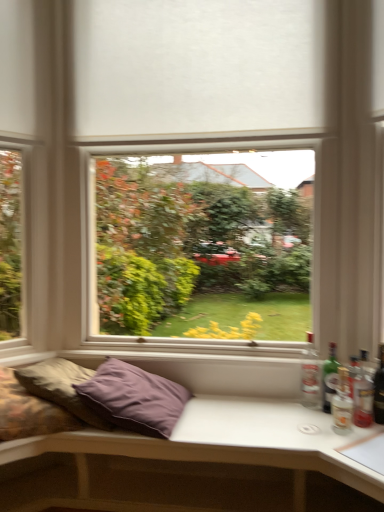
Locate an element on the screen. The height and width of the screenshot is (512, 384). white matte window at center is located at coordinates (192, 136).

This screenshot has width=384, height=512. Describe the element at coordinates (186, 463) in the screenshot. I see `purple fabric studio couch at lower center` at that location.

Image resolution: width=384 pixels, height=512 pixels. What are the coordinates of `white matte window at center` in the screenshot? It's located at (192, 136).

Is white matte window at center not within green glass bottle at right, the second bottle from the left?

white matte window at center lies outside green glass bottle at right, the second bottle from the left,'s area.

From the image's perspective, relative to green glass bottle at right, placed as the 2th bottle when sorted from front to back, is white matte window at center above or below?

From the image's perspective, white matte window at center appears above green glass bottle at right, placed as the 2th bottle when sorted from front to back.

Is white matte window at center directly adjacent to green glass bottle at right, the second bottle in the back-to-front sequence?

white matte window at center is not next to green glass bottle at right, the second bottle in the back-to-front sequence, and they're not touching.

How far apart are white matte window at center and green glass bottle at right, arranged as the 2th bottle when viewed from the right?

A distance of 1.12 meters exists between white matte window at center and green glass bottle at right, arranged as the 2th bottle when viewed from the right.

Based on the photo, in terms of height, does green glass bottle at right, placed as the 2th bottle when sorted from front to back, look taller or shorter compared to purple fabric pillow at lower left, the 2th pillow from the right?

Considering their sizes, green glass bottle at right, placed as the 2th bottle when sorted from front to back, has more height than purple fabric pillow at lower left, the 2th pillow from the right.

Considering the sizes of objects green glass bottle at right, the second bottle from the left, and purple fabric pillow at lower left, the 2th pillow from the right, in the image provided, who is bigger, green glass bottle at right, the second bottle from the left, or purple fabric pillow at lower left, the 2th pillow from the right,?

purple fabric pillow at lower left, the 2th pillow from the right, is bigger.

Is purple fabric pillow at lower left, the 2th pillow from the right, surrounded by green glass bottle at right, the second bottle from the left?

No, purple fabric pillow at lower left, the 2th pillow from the right, is not inside green glass bottle at right, the second bottle from the left.

This screenshot has height=512, width=384. I want to click on the 1st pillow positioned below the green glass bottle at right, arranged as the 2th bottle when viewed from the right (from the image's perspective), so click(x=61, y=387).

Which object is wider, purple fabric studio couch at lower center or translucent glass beer bottle at right?

purple fabric studio couch at lower center.

Based on their positions, is purple fabric studio couch at lower center located to the left or right of translucent glass beer bottle at right?

purple fabric studio couch at lower center is positioned on translucent glass beer bottle at right's left side.

Based on the photo, which object is closer to the camera taking this photo, purple fabric studio couch at lower center or translucent glass beer bottle at right?

purple fabric studio couch at lower center.

Can you tell me how much purple fabric studio couch at lower center and translucent glass beer bottle at right differ in facing direction?

purple fabric studio couch at lower center and translucent glass beer bottle at right are facing 44.6 degrees away from each other.

Between purple fabric pillow at lower left, the 2th pillow from the right, and white matte window at center, which one has less height?

With less height is purple fabric pillow at lower left, the 2th pillow from the right.

From a real-world perspective, who is located lower, purple fabric pillow at lower left, the 2th pillow from the right, or white matte window at center?

In real-world perspective, purple fabric pillow at lower left, the 2th pillow from the right, is lower.

Considering the relative positions of purple fabric pillow at lower left, the 2th pillow from the right, and white matte window at center in the image provided, is purple fabric pillow at lower left, the 2th pillow from the right, to the left or to the right of white matte window at center?

purple fabric pillow at lower left, the 2th pillow from the right, is to the left of white matte window at center.

Between purple fabric pillow at lower left, the 2th pillow from the right, and white matte window at center, which one is positioned in front?

Positioned in front is purple fabric pillow at lower left, the 2th pillow from the right.

Is purple fabric pillow at lower left, which is the 1th pillow from left to right, aimed at green glass bottle at right, the second bottle from the left?

No, purple fabric pillow at lower left, which is the 1th pillow from left to right, is not turned towards green glass bottle at right, the second bottle from the left.

Would you say purple fabric pillow at lower left, the 2th pillow from the right, is outside green glass bottle at right, the second bottle in the back-to-front sequence?

Yes.

Does point (34, 372) come farther from viewer compared to point (328, 380)?

No, it is not.

From a real-world perspective, which is physically above, purple fabric pillow at lower left, which is the 1th pillow from left to right, or green glass bottle at right, placed as the 2th bottle when sorted from front to back?

green glass bottle at right, placed as the 2th bottle when sorted from front to back, is physically above.

Is green glass bottle at right, arranged as the 2th bottle when viewed from the right, bigger than clear glass bottle at right, marked as the 1th bottle in a left-to-right arrangement?

Actually, green glass bottle at right, arranged as the 2th bottle when viewed from the right, might be smaller than clear glass bottle at right, marked as the 1th bottle in a left-to-right arrangement.

Considering the sizes of green glass bottle at right, the second bottle from the left, and clear glass bottle at right, which ranks as the third bottle in right-to-left order, in the image, is green glass bottle at right, the second bottle from the left, taller or shorter than clear glass bottle at right, which ranks as the third bottle in right-to-left order,?

Considering their sizes, green glass bottle at right, the second bottle from the left, has less height than clear glass bottle at right, which ranks as the third bottle in right-to-left order.

Does green glass bottle at right, the second bottle in the back-to-front sequence, have a greater width compared to clear glass bottle at right, the 3th bottle viewed from the front?

In fact, green glass bottle at right, the second bottle in the back-to-front sequence, might be narrower than clear glass bottle at right, the 3th bottle viewed from the front.

Is green glass bottle at right, arranged as the 2th bottle when viewed from the right, positioned behind clear glass bottle at right, marked as the 1th bottle in a left-to-right arrangement?

No, green glass bottle at right, arranged as the 2th bottle when viewed from the right, is closer to the viewer.

Considering the relative sizes of white matte window at center and translucent glass bottle at right, which is the third bottle from back to front, in the image provided, is white matte window at center bigger than translucent glass bottle at right, which is the third bottle from back to front,?

Yes, white matte window at center is bigger than translucent glass bottle at right, which is the third bottle from back to front.

From the image's perspective, which object appears higher, white matte window at center or translucent glass bottle at right, placed as the 3th bottle when sorted from left to right?

white matte window at center, from the image's perspective.

Which is behind, white matte window at center or translucent glass bottle at right, which is the third bottle from back to front?

Positioned behind is white matte window at center.

Is white matte window at center at the left side of translucent glass bottle at right, the first bottle viewed from the right?

Correct, you'll find white matte window at center to the left of translucent glass bottle at right, the first bottle viewed from the right.

Locate an element on the screen. The width and height of the screenshot is (384, 512). window above the green glass bottle at right, arranged as the 2th bottle when viewed from the right (from a real-world perspective) is located at coordinates (192, 136).

What are the coordinates of `the 1st pillow in front of the green glass bottle at right, the second bottle in the back-to-front sequence, starting your count from the anchor` in the screenshot? It's located at (61, 387).

From the image, which object appears to be nearer to green glass bottle at right, arranged as the 2th bottle when viewed from the right, white matte window at center or purple fabric studio couch at lower center?

purple fabric studio couch at lower center lies closer to green glass bottle at right, arranged as the 2th bottle when viewed from the right, than the other object.

Which object lies nearer to the anchor point purple fabric studio couch at lower center, white matte window at center or purple fabric pillow at lower left, which is the 1th pillow from left to right?

Based on the image, purple fabric pillow at lower left, which is the 1th pillow from left to right, appears to be nearer to purple fabric studio couch at lower center.

Based on their spatial positions, is purple fabric studio couch at lower center or translucent glass bottle at right, which ranks as the first bottle in front-to-back order, closer to purple fabric pillow at lower left, placed as the second pillow when sorted from left to right?

purple fabric studio couch at lower center.

From the image, which object appears to be farther from translucent glass bottle at right, placed as the 3th bottle when sorted from left to right, white matte window at center or purple fabric pillow at lower left, the 2th pillow from the right?

purple fabric pillow at lower left, the 2th pillow from the right, lies further to translucent glass bottle at right, placed as the 3th bottle when sorted from left to right, than the other object.

When comparing their distances from translucent glass beer bottle at right, does translucent glass bottle at right, the first bottle viewed from the right, or white matte window at center seem closer?

Based on the image, translucent glass bottle at right, the first bottle viewed from the right, appears to be nearer to translucent glass beer bottle at right.

Looking at the image, which one is located further to purple fabric studio couch at lower center, purple fabric pillow at lower left, the 2th pillow from the right, or clear glass bottle at right, the 3th bottle viewed from the front?

Among the two, clear glass bottle at right, the 3th bottle viewed from the front, is located further to purple fabric studio couch at lower center.

Estimate the real-world distances between objects in this image. Which object is further from white matte window at center, clear glass bottle at right, which is the first bottle from back to front, or purple fabric studio couch at lower center?

Based on the image, clear glass bottle at right, which is the first bottle from back to front, appears to be further to white matte window at center.

From the image, which object appears to be farther from translucent glass beer bottle at right, green glass bottle at right, the second bottle from the left, or clear glass bottle at right, the 3th bottle viewed from the front?

clear glass bottle at right, the 3th bottle viewed from the front, is positioned further to the anchor translucent glass beer bottle at right.

Where is `studio couch situated between purple fabric pillow at lower left, placed as the 1th pillow when sorted from right to left, and translucent glass bottle at right, the first bottle viewed from the right, from left to right`? The height and width of the screenshot is (512, 384). studio couch situated between purple fabric pillow at lower left, placed as the 1th pillow when sorted from right to left, and translucent glass bottle at right, the first bottle viewed from the right, from left to right is located at coordinates (186, 463).

Identify the location of window located between purple fabric pillow at lower left, which is the 1th pillow from left to right, and translucent glass bottle at right, placed as the 3th bottle when sorted from left to right, in the left-right direction. This screenshot has width=384, height=512. (192, 136).

Where is `bottle between translucent glass bottle at right, which is the third bottle from back to front, and clear glass bottle at right, the 3th bottle viewed from the front, from front to back`? The height and width of the screenshot is (512, 384). bottle between translucent glass bottle at right, which is the third bottle from back to front, and clear glass bottle at right, the 3th bottle viewed from the front, from front to back is located at coordinates (329, 378).

Locate an element on the screen. The image size is (384, 512). pillow situated between purple fabric pillow at lower left, which is the 1th pillow from left to right, and translucent glass beer bottle at right from left to right is located at coordinates 134,398.